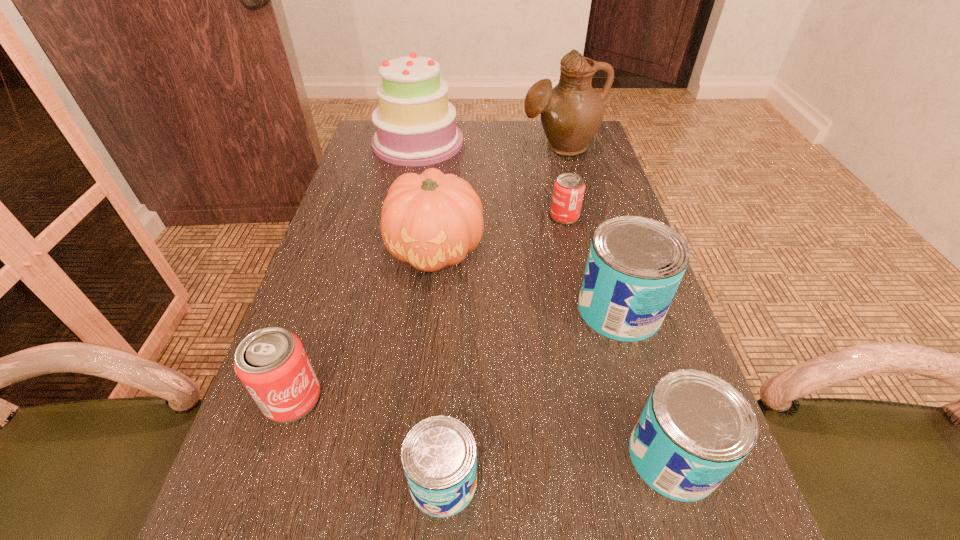
This screenshot has width=960, height=540. I want to click on brown pitcher, so click(571, 113).

Image resolution: width=960 pixels, height=540 pixels. In order to click on cake in this screenshot , I will do `click(415, 123)`.

Locate an element on the screen. This screenshot has height=540, width=960. pumpkin is located at coordinates (432, 220).

Locate an element on the screen. This screenshot has width=960, height=540. the biggest blue can is located at coordinates (635, 264).

Where is `the farthest blue can`? Image resolution: width=960 pixels, height=540 pixels. the farthest blue can is located at coordinates (635, 264).

Locate an element on the screen. The image size is (960, 540). the left red can is located at coordinates (272, 364).

Identify the location of the nearer red can. (272, 364).

The height and width of the screenshot is (540, 960). I want to click on the second biggest blue can, so click(x=695, y=429).

Where is `the smallest blue can`? the smallest blue can is located at coordinates (439, 457).

Where is `the leftmost blue can`? This screenshot has height=540, width=960. the leftmost blue can is located at coordinates (439, 457).